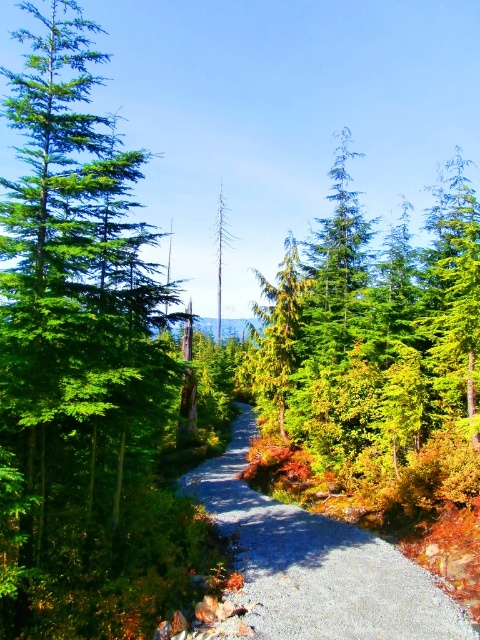
You are a hiker standing at the starting point of the gravel path in the forest. You see two points marked in the scene. Which point is closer to you, point (457, 397) or point (307, 560)?

Point (457, 397) is closer to you because it is further to the viewer than point (307, 560).

You are a hiker with a 2.5 meter wide tent. You see the green matte tree at center and the gray gravel path at center. Can your tent fit on the path without touching the tree?

The green matte tree at center might be wider than the gray gravel path at center, so there is a possibility that the tree is wider than the path. Therefore, the tent might not fit without touching the tree. It is advisable to check the actual width before placing the tent.

You are a hiker with a 10 meter long rope. You want to tie the green matte tree at center to the gray gravel path at center to secure your gear. Is the rope long enough to reach between them?

The green matte tree at center is 9.51 meters away from the gray gravel path at center. Since the rope is 10 meters long, it is long enough to reach between them.